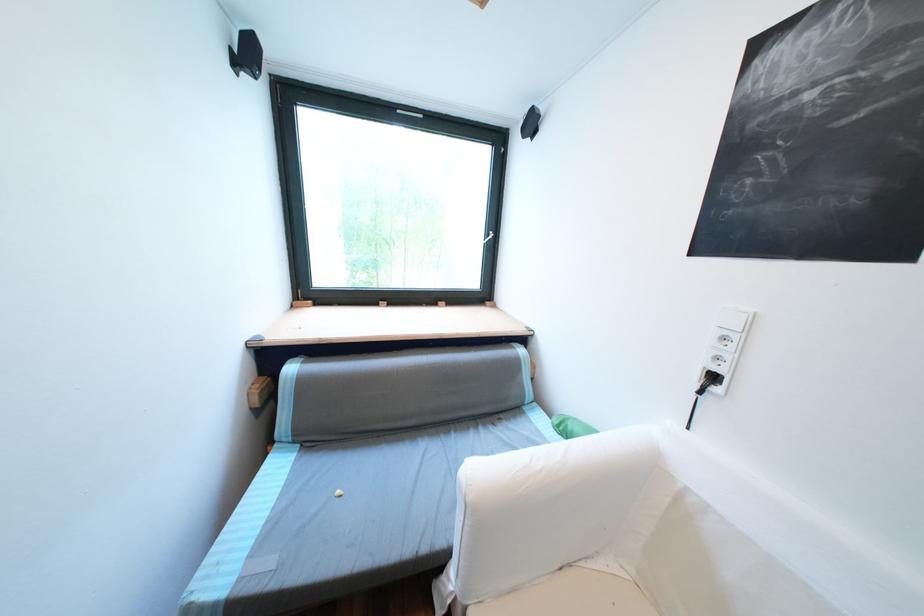
What do you see at coordinates (377, 503) in the screenshot?
I see `the mattress sitting surface` at bounding box center [377, 503].